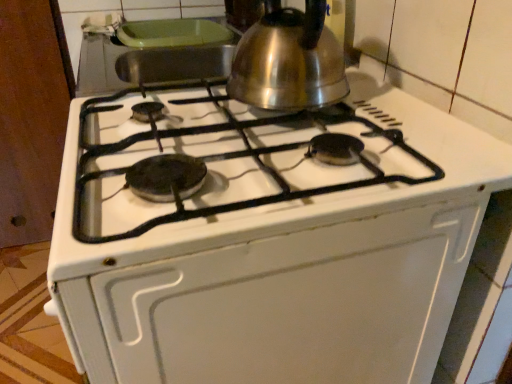
Question: Do you think satin silver kettle at upper center is within white matte oven at center, or outside of it?

Choices:
 (A) inside
 (B) outside

Answer: (B)

Question: In terms of height, does satin silver kettle at upper center look taller or shorter compared to white matte oven at center?

Choices:
 (A) short
 (B) tall

Answer: (A)

Question: From the image's perspective, is satin silver kettle at upper center above or below white matte oven at center?

Choices:
 (A) above
 (B) below

Answer: (A)

Question: In the image, is white matte oven at center positioned in front of or behind satin silver kettle at upper center?

Choices:
 (A) behind
 (B) front

Answer: (B)

Question: Based on their sizes in the image, would you say white matte oven at center is bigger or smaller than satin silver kettle at upper center?

Choices:
 (A) big
 (B) small

Answer: (A)

Question: Is white matte oven at center spatially inside satin silver kettle at upper center, or outside of it?

Choices:
 (A) inside
 (B) outside

Answer: (B)

Question: From the image's perspective, is white matte oven at center positioned above or below satin silver kettle at upper center?

Choices:
 (A) above
 (B) below

Answer: (B)